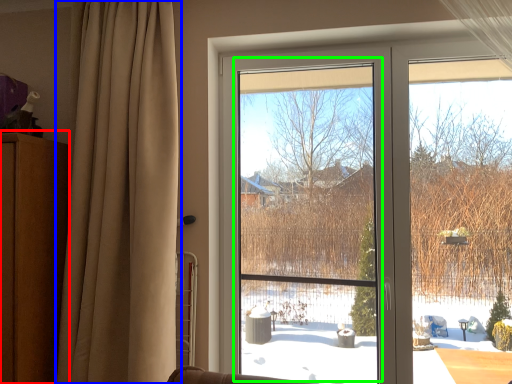
Question: Estimate the real-world distances between objects in this image. Which object is closer to dresser (highlighted by a red box), curtain (highlighted by a blue box) or window screen (highlighted by a green box)?

Choices:
 (A) curtain
 (B) window screen

Answer: (A)